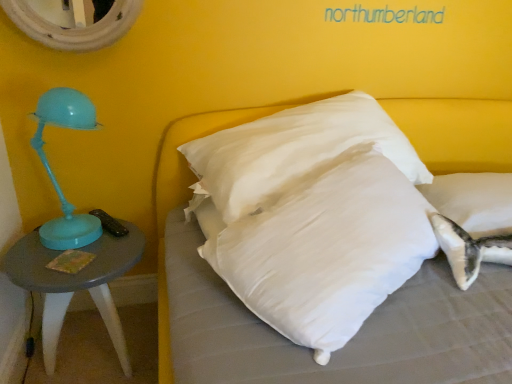
Question: Do you think white soft pillow at center is within white textured mirror at upper left, or outside of it?

Choices:
 (A) inside
 (B) outside

Answer: (B)

Question: Is white soft pillow at center to the left or to the right of white textured mirror at upper left in the image?

Choices:
 (A) left
 (B) right

Answer: (B)

Question: Which object is the farthest from the white soft pillow at center?

Choices:
 (A) white soft pillow at center
 (B) white textured mirror at upper left
 (C) matte gray table at left

Answer: (C)

Question: Estimate the real-world distances between objects in this image. Which object is closer to the white soft pillow at center?

Choices:
 (A) matte gray table at left
 (B) white soft pillow at center
 (C) white textured mirror at upper left

Answer: (B)